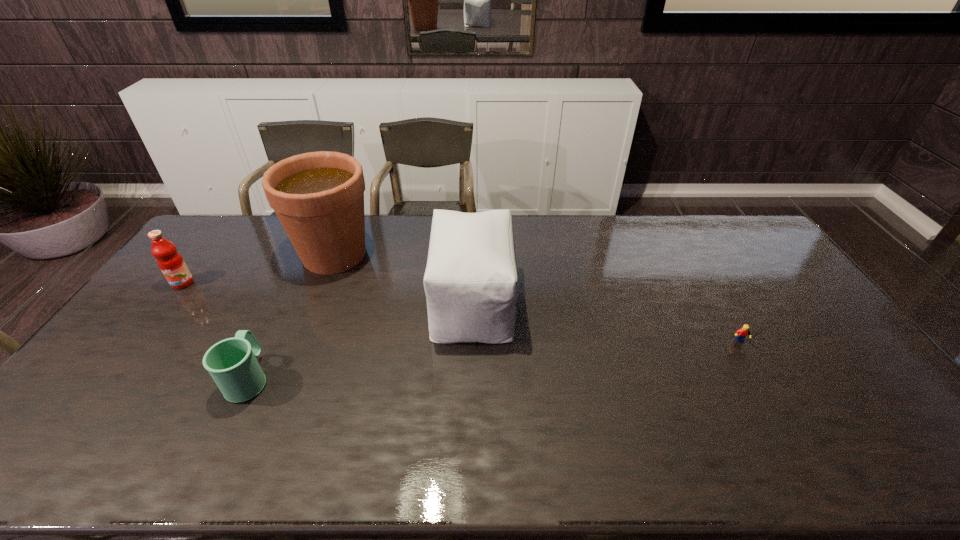
Find the location of a particular element. This screenshot has height=540, width=960. free space that is in between the fourth object from left to right and the nearest object is located at coordinates (361, 340).

The width and height of the screenshot is (960, 540). Find the location of `vacant space that's between the flowerpot and the fourth tallest object`. vacant space that's between the flowerpot and the fourth tallest object is located at coordinates tap(292, 316).

Locate an element on the screen. Image resolution: width=960 pixels, height=540 pixels. free spot between the tallest object and the cushion is located at coordinates (403, 278).

Select which object is the third closest to the flowerpot. Please provide its 2D coordinates. Your answer should be formatted as a tuple, i.e. [(x, y)], where the tuple contains the x and y coordinates of a point satisfying the conditions above.

[(232, 363)]

Identify which object is the fourth nearest to the Lego. Please provide its 2D coordinates. Your answer should be formatted as a tuple, i.e. [(x, y)], where the tuple contains the x and y coordinates of a point satisfying the conditions above.

[(171, 263)]

The width and height of the screenshot is (960, 540). I want to click on vacant region that satisfies the following two spatial constraints: 1. on the side of the mug with the handle; 2. on the right side of the tallest object, so click(308, 254).